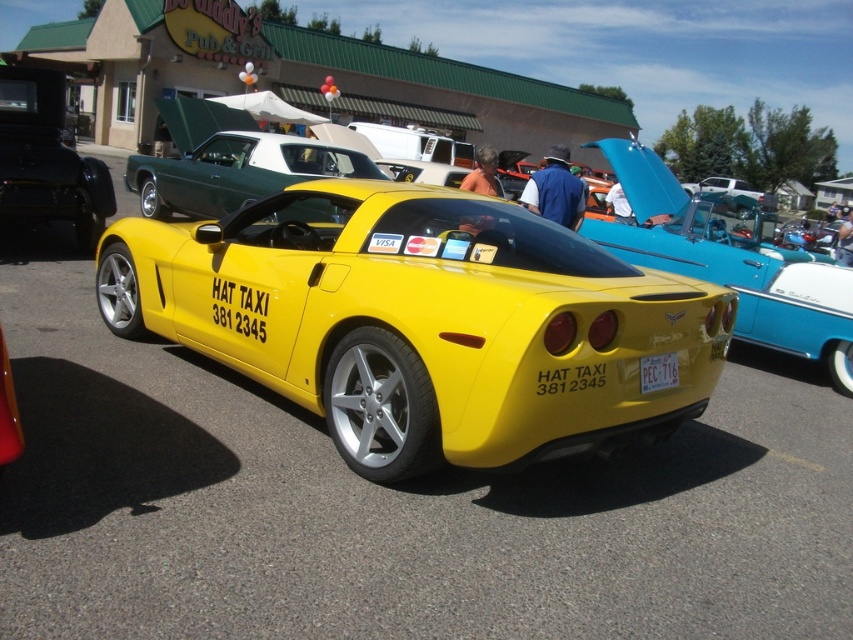
You are a photographer standing in front of the yellow sports car at the car show. You notice two points marked on the car. One is at coordinate point (x=277, y=280) and the other is at point (x=227, y=188). If you want to focus on the point that is closer to your camera, which coordinate should you choose?

The point closer to the camera is at coordinate point (x=277, y=280).

You are a photographer at a car show and need to position a camera to capture both the yellow matte sports car at center and the green metallic car at upper left in the same frame. Based on their positions, which car should be closer to the bottom of the frame?

The yellow matte sports car at center is located below the green metallic car at upper left, so it should be closer to the bottom of the frame.